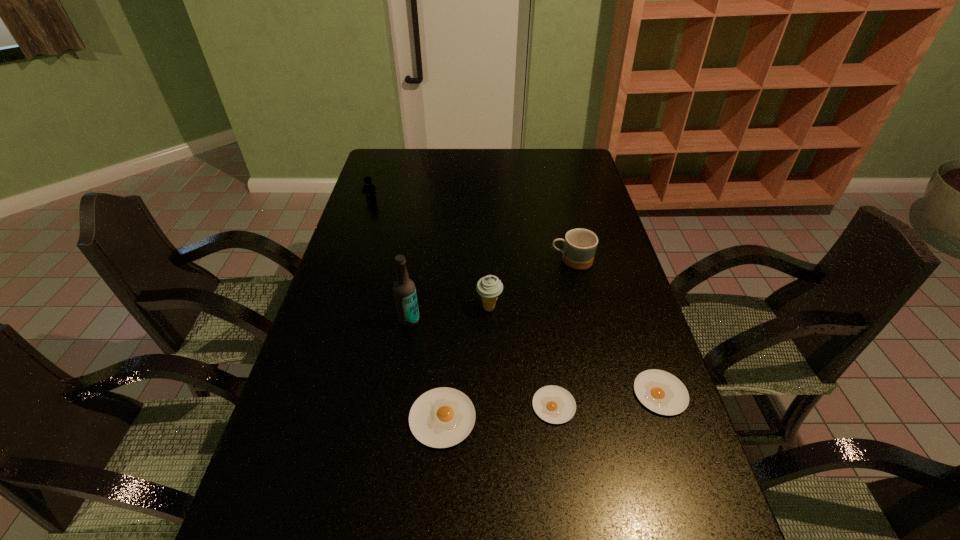
You are a GUI agent. You are given a task and a screenshot of the screen. Output one action in this format:
    pyautogui.click(x=<x>, y=<y>)
    Task: Click on the empty space between the tallest object and the second tallest egg yolk
    The width and height of the screenshot is (960, 540).
    Given the screenshot: What is the action you would take?
    pyautogui.click(x=535, y=357)

The height and width of the screenshot is (540, 960). Find the location of `free spot between the shortest object and the rightmost object`. free spot between the shortest object and the rightmost object is located at coordinates (607, 400).

The height and width of the screenshot is (540, 960). Find the location of `unoccupied area between the beer bottle and the third shortest object`. unoccupied area between the beer bottle and the third shortest object is located at coordinates (426, 369).

Where is `vacant space in between the tallest object and the leftmost object`? The image size is (960, 540). vacant space in between the tallest object and the leftmost object is located at coordinates (390, 260).

Locate an element on the screen. The height and width of the screenshot is (540, 960). free space between the shortest egg yolk and the rightmost egg yolk is located at coordinates (607, 400).

I want to click on free space between the rightmost object and the Lego, so click(x=516, y=296).

This screenshot has height=540, width=960. I want to click on vacant space that's between the farthest object and the beer bottle, so click(390, 260).

Identify the location of vacant area between the sixth shortest object and the beer bottle. The width and height of the screenshot is (960, 540). (449, 314).

Where is `object identified as the fourth closest to the second shortest object`? object identified as the fourth closest to the second shortest object is located at coordinates (442, 417).

In order to click on object that is the closest to the mug in this screenshot , I will do `click(489, 287)`.